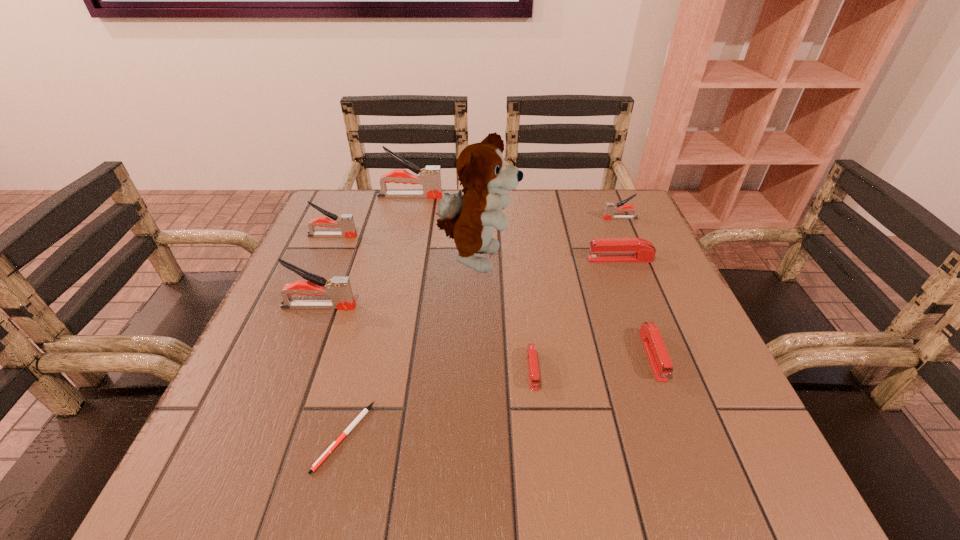
Identify the location of object that is the third closest to the tallest object. (534, 377).

Choose which stapler is the sixth nearest neighbor to the rightmost gray stapler. Please provide its 2D coordinates. Your answer should be formatted as a tuple, i.e. [(x, y)], where the tuple contains the x and y coordinates of a point satisfying the conditions above.

[(339, 289)]

The height and width of the screenshot is (540, 960). What are the coordinates of `stapler identified as the second closest to the biggest gray stapler` in the screenshot? It's located at (339, 289).

Where is `the second closest gray stapler to the fourth nearest stapler`? This screenshot has width=960, height=540. the second closest gray stapler to the fourth nearest stapler is located at coordinates coord(430,177).

Locate which gray stapler is the third closest to the second smallest red stapler. Please provide its 2D coordinates. Your answer should be formatted as a tuple, i.e. [(x, y)], where the tuple contains the x and y coordinates of a point satisfying the conditions above.

[(430, 177)]

Locate which red stapler ranks second in proximity to the sixth tallest stapler. Please provide its 2D coordinates. Your answer should be formatted as a tuple, i.e. [(x, y)], where the tuple contains the x and y coordinates of a point satisfying the conditions above.

[(604, 250)]

Where is `the closest red stapler to the second nearest gray stapler`? The image size is (960, 540). the closest red stapler to the second nearest gray stapler is located at coordinates (534, 377).

This screenshot has height=540, width=960. I want to click on vacant space that satisfies the following two spatial constraints: 1. on the handle side of the second farthest object; 2. on the front-facing side of the sixth object from left to right, so click(x=685, y=370).

The width and height of the screenshot is (960, 540). Find the location of `free spot that satisfies the following two spatial constraints: 1. on the handle side of the rightmost gray stapler; 2. on the front-facing side of the seventh tallest object`. free spot that satisfies the following two spatial constraints: 1. on the handle side of the rightmost gray stapler; 2. on the front-facing side of the seventh tallest object is located at coordinates (679, 355).

Identify the location of blank space that satisfies the following two spatial constraints: 1. on the front-facing side of the biggest red stapler; 2. on the front-facing side of the third shortest object. The width and height of the screenshot is (960, 540). (657, 355).